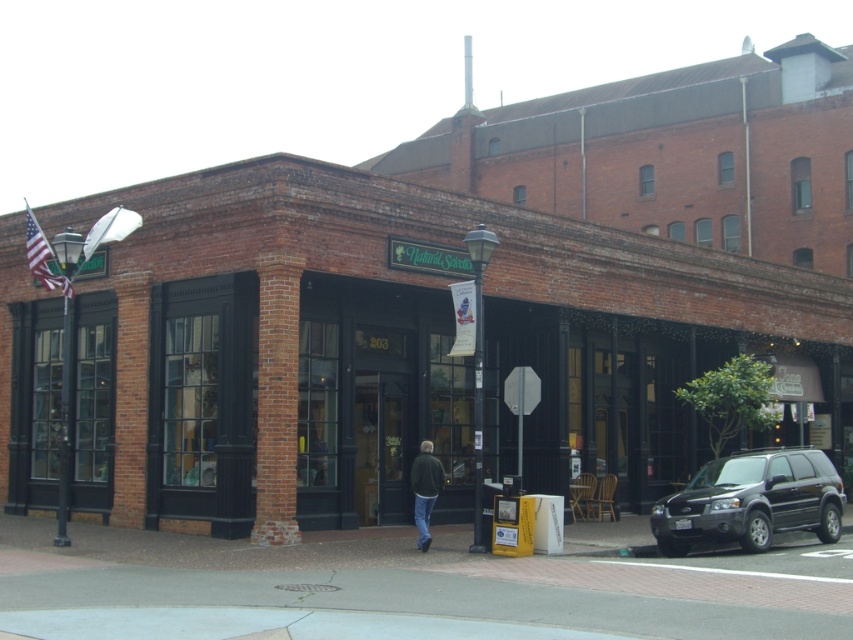
You are a delivery driver approaching the brick storefront at center and the black matte suv at lower right. Which object should you look up to see first?

The brick storefront at center is above the black matte suv at lower right, so you should look up to see the brick storefront at center first.

You are a pedestrian standing at the street corner near the stop sign and lamp post. You see a black matte suv at lower right and a dark green jacket at center. Which object is taller?

The dark green jacket at center is taller than the black matte suv at lower right according to the description.

You are a pedestrian standing at the street corner near the stop sign. You see a black matte suv at lower right and a dark green jacket at center. Which object is positioned to the right of the other?

The black matte suv at lower right is positioned to the right of the dark green jacket at center.